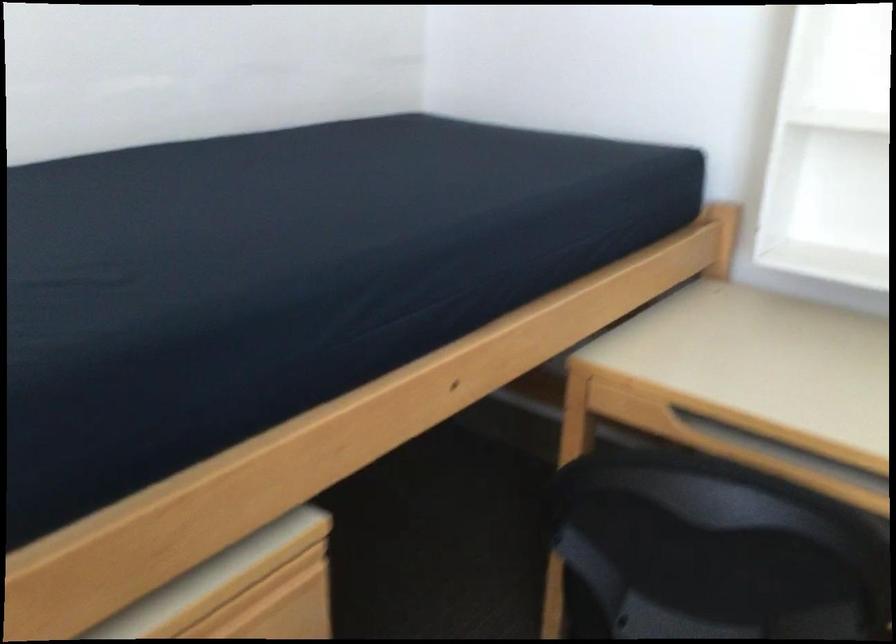
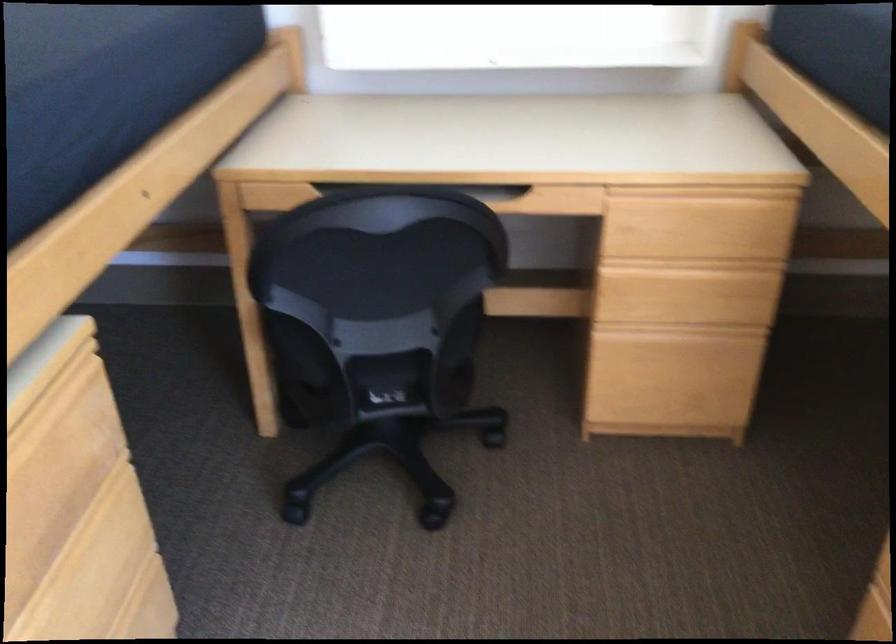
Question: The camera is either moving clockwise (left) or counter-clockwise (right) around the object. The first image is from the beginning of the video and the second image is from the end. Is the camera moving left or right when shooting the video?

Choices:
 (A) Left
 (B) Right

Answer: (A)